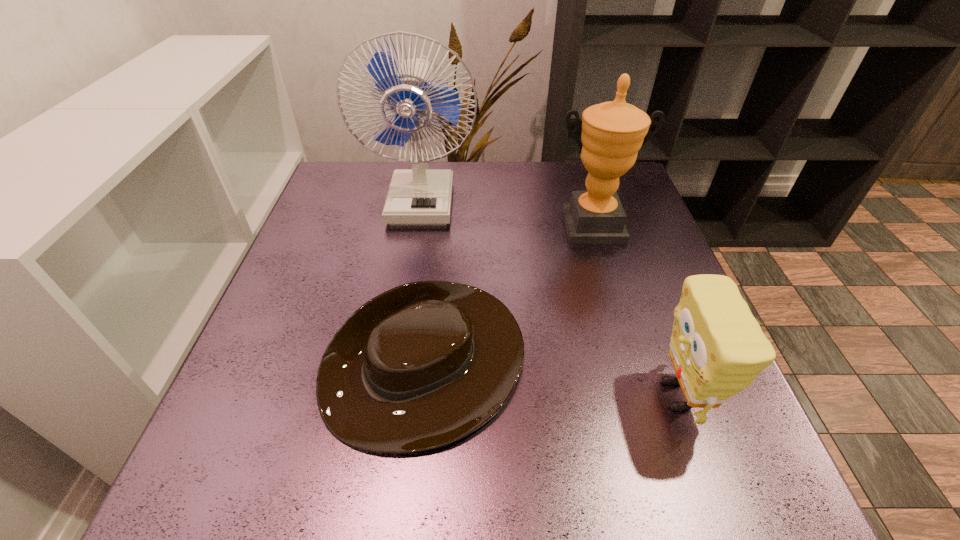
The height and width of the screenshot is (540, 960). Identify the location of fan. 419,196.

Locate an element on the screen. The width and height of the screenshot is (960, 540). award is located at coordinates (613, 132).

Where is `the second shortest object`? the second shortest object is located at coordinates click(717, 348).

Locate an element on the screen. This screenshot has height=540, width=960. the shortest object is located at coordinates (420, 366).

Image resolution: width=960 pixels, height=540 pixels. Identify the location of free spot located on the front-facing side of the fan. (394, 364).

Identify the location of vacant area located at the front of the award with handles. (637, 380).

The image size is (960, 540). Identify the location of vacant space situated 0.330m on the face of the second shortest object. (457, 395).

I want to click on free spot located on the face of the second shortest object, so click(469, 395).

Locate an element on the screen. vacant space situated on the face of the second shortest object is located at coordinates (616, 395).

You are a GUI agent. You are given a task and a screenshot of the screen. Output one action in this format:
    pyautogui.click(x=<x>, y=<y>)
    Task: Click on the free space located 0.190m on the right of the cowboy hat
    The height and width of the screenshot is (540, 960).
    Given the screenshot: What is the action you would take?
    pyautogui.click(x=631, y=367)